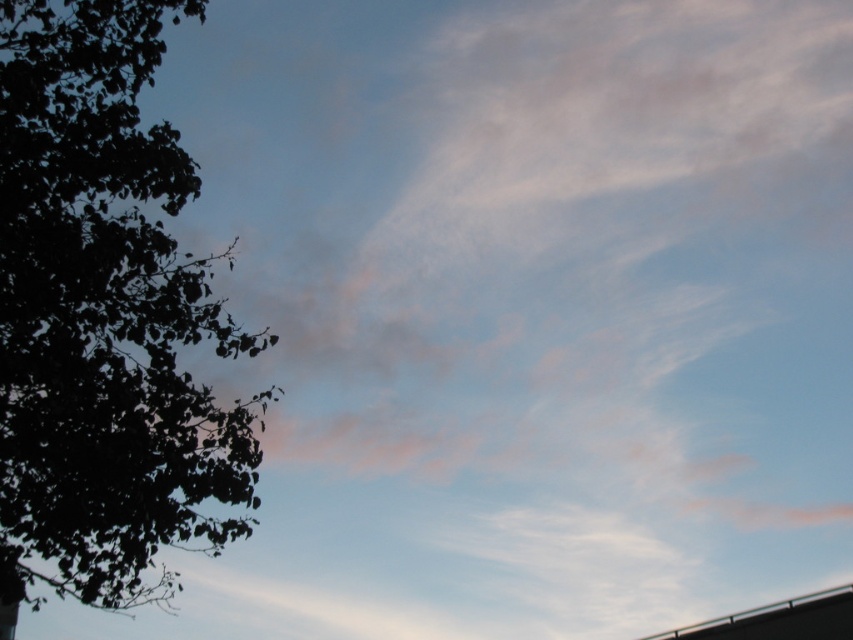
Question: Which object is closer to the camera taking this photo?

Choices:
 (A) dark green leafy tree at left
 (B) metallic gray overpass at bottom right

Answer: (A)

Question: Considering the relative positions of dark green leafy tree at left and metallic gray overpass at bottom right in the image provided, where is dark green leafy tree at left located with respect to metallic gray overpass at bottom right?

Choices:
 (A) above
 (B) below

Answer: (A)

Question: Which object appears farthest from the camera in this image?

Choices:
 (A) metallic gray overpass at bottom right
 (B) dark green leafy tree at left

Answer: (A)

Question: Which point appears closest to the camera in this image?

Choices:
 (A) (775, 625)
 (B) (25, 42)

Answer: (B)

Question: Is dark green leafy tree at left thinner than metallic gray overpass at bottom right?

Choices:
 (A) no
 (B) yes

Answer: (A)

Question: Is dark green leafy tree at left to the left of metallic gray overpass at bottom right from the viewer's perspective?

Choices:
 (A) yes
 (B) no

Answer: (A)